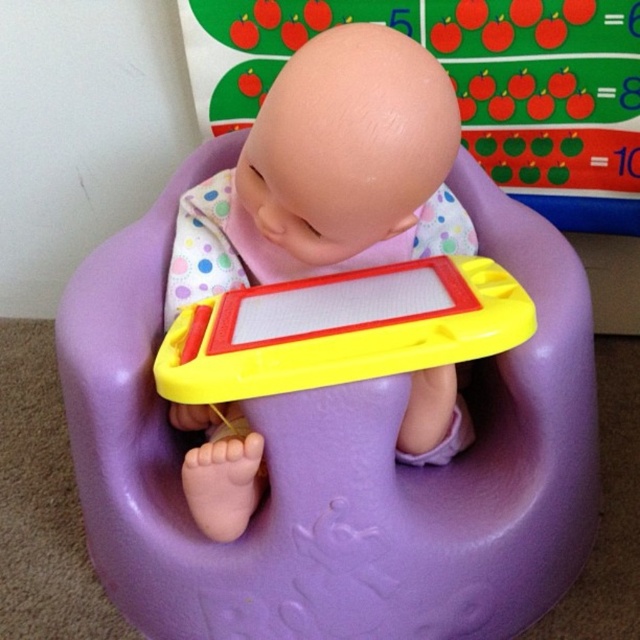
Who is positioned more to the right, matte plastic baby at center or yellow plastic toy at center?

yellow plastic toy at center is more to the right.

Locate an element on the screen. matte plastic baby at center is located at coordinates (330, 172).

Between purple plastic feeding chair at center and yellow plastic toy at center, which one appears on the right side from the viewer's perspective?

yellow plastic toy at center

You are a GUI agent. You are given a task and a screenshot of the screen. Output one action in this format:
    pyautogui.click(x=<x>, y=<y>)
    Task: Click on the purple plastic feeding chair at center
    
    Given the screenshot: What is the action you would take?
    pyautogui.click(x=339, y=460)

Between purple plastic feeding chair at center and matte plastic baby at center, which one has less height?

matte plastic baby at center

Image resolution: width=640 pixels, height=640 pixels. What do you see at coordinates (339, 460) in the screenshot? I see `purple plastic feeding chair at center` at bounding box center [339, 460].

Measure the distance between point (102, 362) and camera.

Point (102, 362) is 32.99 inches away from camera.

Where is `purple plastic feeding chair at center`? purple plastic feeding chair at center is located at coordinates (339, 460).